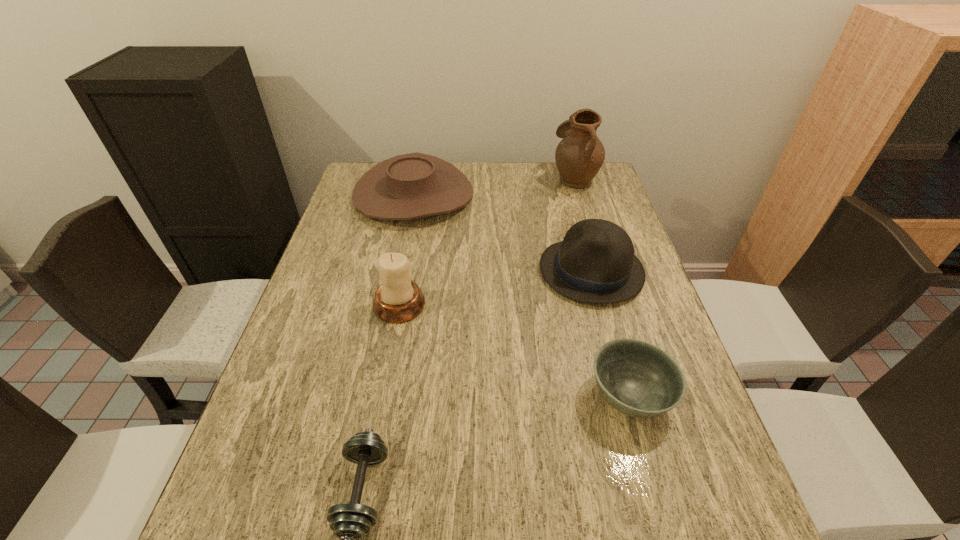
I want to click on vacant region located 0.220m on the front-facing side of the bowler hat, so click(459, 271).

In order to click on free space located 0.320m on the front-facing side of the bowler hat in this screenshot , I will do `click(422, 271)`.

You are a GUI agent. You are given a task and a screenshot of the screen. Output one action in this format:
    pyautogui.click(x=<x>, y=<y>)
    Task: Click on the free spot located on the front of the cowboy hat
    This screenshot has height=540, width=960.
    Given the screenshot: What is the action you would take?
    pyautogui.click(x=400, y=260)

At what (x,y) coordinates should I click in order to perform the action: click on free spot located on the right of the bowl. Please return your answer as a coordinate pair (x, y). The width and height of the screenshot is (960, 540). Looking at the image, I should click on (696, 396).

Image resolution: width=960 pixels, height=540 pixels. What are the coordinates of `pitcher situated at the far edge` in the screenshot? It's located at (579, 156).

Find the location of a particular element. cowboy hat present at the far edge is located at coordinates (409, 186).

This screenshot has width=960, height=540. I want to click on object that is at the left edge, so click(409, 186).

In order to click on pitcher at the right edge in this screenshot , I will do `click(579, 156)`.

The height and width of the screenshot is (540, 960). In order to click on bowler hat located in the right edge section of the desktop in this screenshot , I will do `click(595, 263)`.

The height and width of the screenshot is (540, 960). What are the coordinates of `bowl that is at the right edge` in the screenshot? It's located at (637, 378).